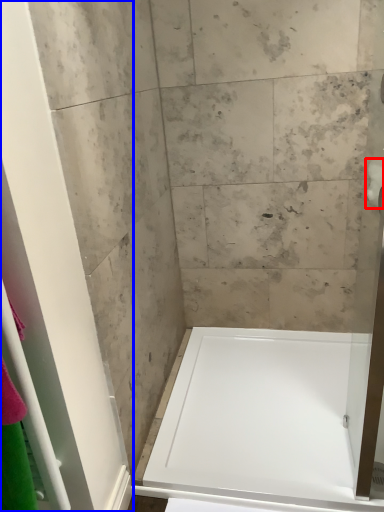
Question: Among these objects, which one is nearest to the camera, toilet paper (highlighted by a red box) or screen door (highlighted by a blue box)?

Choices:
 (A) toilet paper
 (B) screen door

Answer: (B)